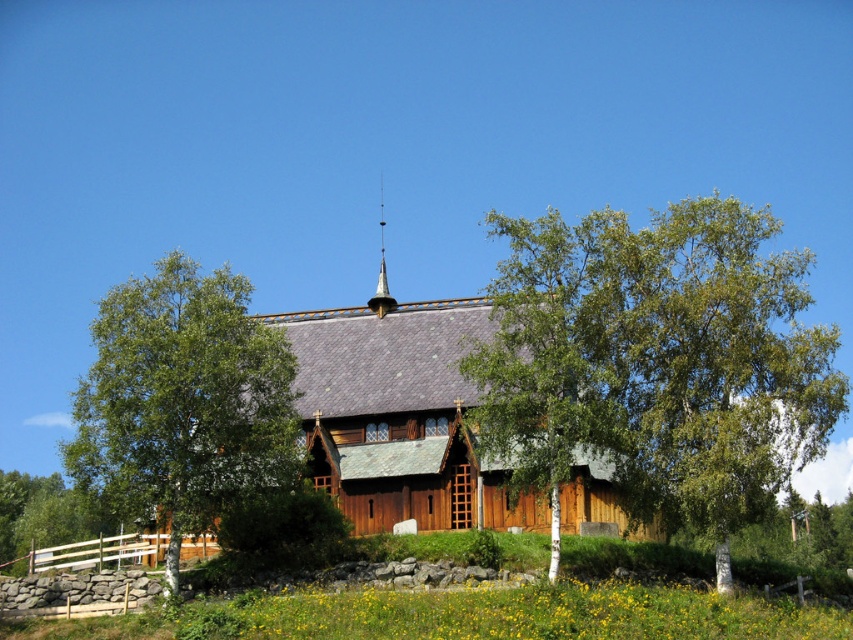
You are standing in front of the church and want to take a photo of the shiny gold spire at center top without the green leafy tree at center blocking the view. Is it possible to do so from your current position?

The green leafy tree at center is positioned under the shiny gold spire at center top, so the tree is directly below the spire. Therefore, you can take a photo of the shiny gold spire at center top without the green leafy tree at center blocking the view by angling the camera upwards to avoid the tree.

You are standing in front of the church and notice two points marked on the image. Which point, point (276, 403) or point (386, 296), is closer to you?

Point (276, 403) is closer to you than point (386, 296).